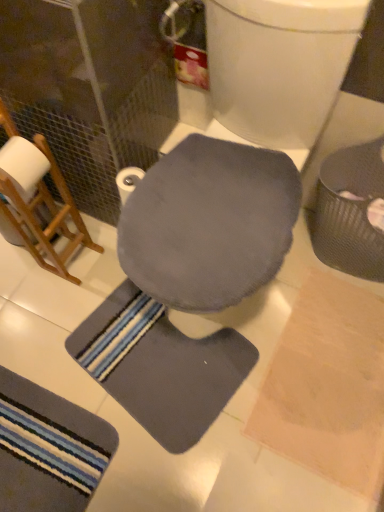
Question: Considering the positions of matte gray swivel chair at center and gray soft mat at center, which is the second bath mat from left to right, in the image, is matte gray swivel chair at center wider or thinner than gray soft mat at center, which is the second bath mat from left to right,?

Choices:
 (A) wide
 (B) thin

Answer: (A)

Question: From a real-world perspective, relative to gray soft mat at center, acting as the first bath mat starting from the right, is matte gray swivel chair at center vertically above or below?

Choices:
 (A) above
 (B) below

Answer: (A)

Question: Based on their relative distances, which object is farther from the metallic textured trash can at right?

Choices:
 (A) gray soft mat at center, which is the second bath mat from left to right
 (B) white matte toilet paper at center
 (C) matte gray swivel chair at center
 (D) striped fabric bath mat at lower left, positioned as the second bath mat in right-to-left order

Answer: (D)

Question: Estimate the real-world distances between objects in this image. Which object is closer to the striped fabric bath mat at lower left, positioned as the second bath mat in right-to-left order?

Choices:
 (A) white matte toilet paper at center
 (B) matte gray swivel chair at center
 (C) gray soft mat at center, acting as the first bath mat starting from the right
 (D) metallic textured trash can at right

Answer: (C)